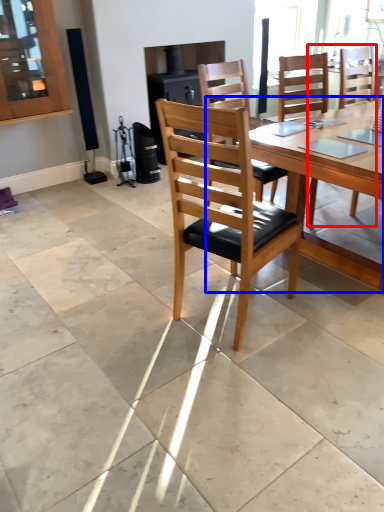
Question: Which object appears farthest to the camera in this image, chair (highlighted by a red box) or round table (highlighted by a blue box)?

Choices:
 (A) chair
 (B) round table

Answer: (A)